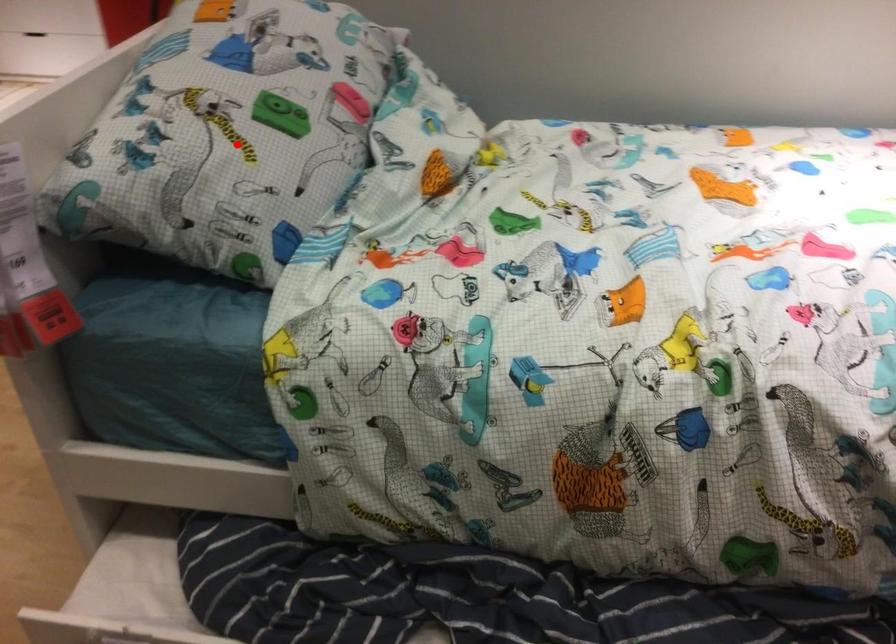
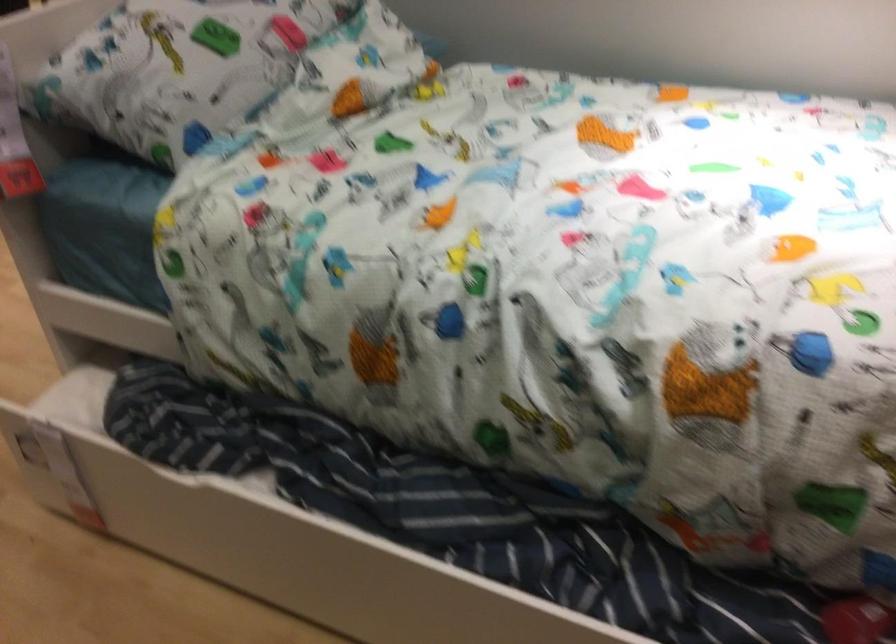
Find the pixel in the second image that matches the highlighted location in the first image.

(177, 62)